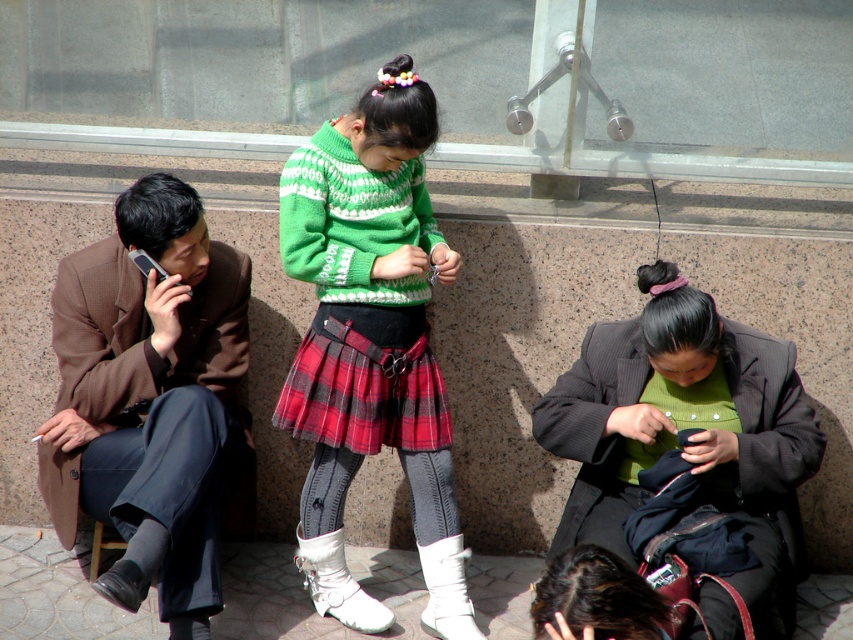
Which is more to the right, green woolen sweater at center or red plaid skirt at center?

Positioned to the right is green woolen sweater at center.

Is green woolen sweater at center to the right of red plaid skirt at center from the viewer's perspective?

Correct, you'll find green woolen sweater at center to the right of red plaid skirt at center.

Who is more distant from viewer, [640,314] or [422,440]?

Point [640,314]

The height and width of the screenshot is (640, 853). What are the coordinates of `green woolen sweater at center` in the screenshot? It's located at (691, 426).

Does brown woolen coat at left have a greater height compared to red plaid skirt at center?

Yes.

Does brown woolen coat at left have a lesser height compared to red plaid skirt at center?

Incorrect, brown woolen coat at left's height does not fall short of red plaid skirt at center's.

Locate an element on the screen. This screenshot has width=853, height=640. brown woolen coat at left is located at coordinates (149, 400).

Can you confirm if green knitted sweater at center is taller than red plaid skirt at center?

Yes.

Which is more to the left, green knitted sweater at center or red plaid skirt at center?

red plaid skirt at center

Is point (383, 109) positioned after point (306, 371)?

No, (383, 109) is in front of (306, 371).

You are a GUI agent. You are given a task and a screenshot of the screen. Output one action in this format:
    pyautogui.click(x=<x>, y=<y>)
    Task: Click on the green knitted sweater at center
    The height and width of the screenshot is (640, 853).
    Given the screenshot: What is the action you would take?
    pyautogui.click(x=370, y=342)